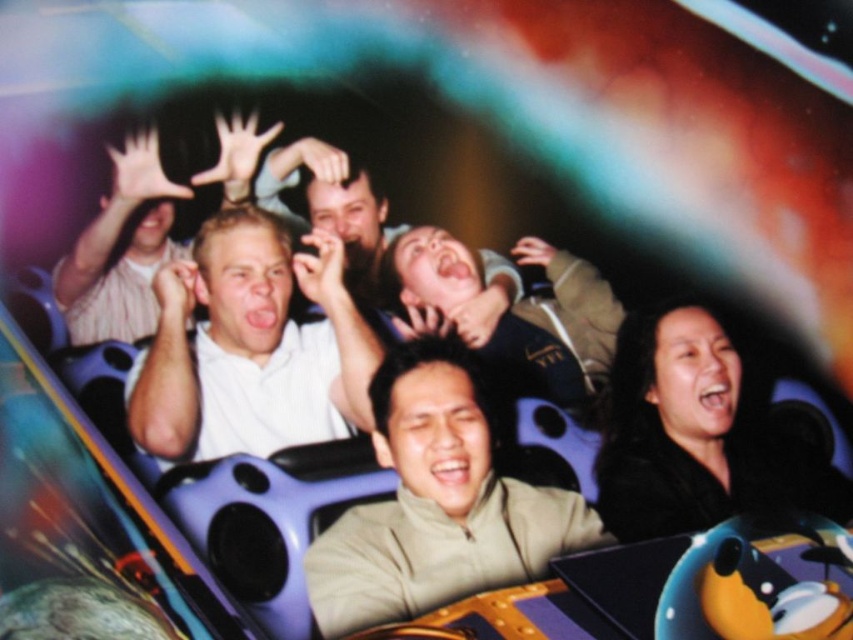
You are a photographer trying to capture a candid shot of the tan matte jacket at center and the white matte shirt at center. Which one is located to the right of the other?

The tan matte jacket at center is positioned on the right side of white matte shirt at center.

You are standing in front of the roller coaster and see the point marked at (437, 502). What object is located at that point?

The tan matte jacket at center is located at the point marked at (437, 502).